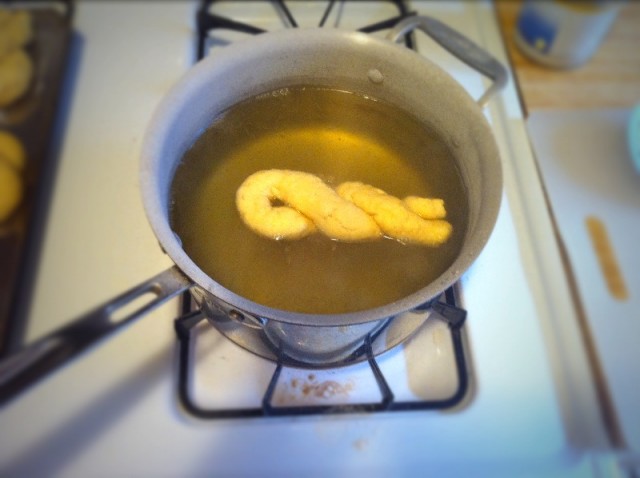
Where is `countertop`? countertop is located at coordinates (619, 75).